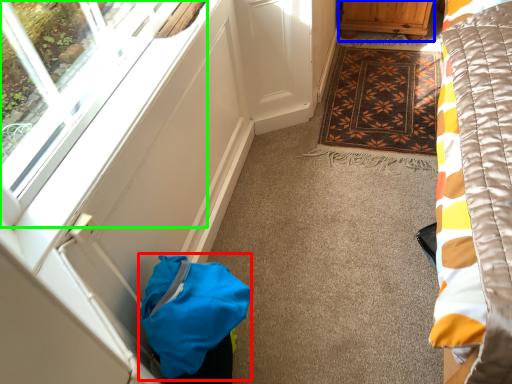
Question: Which is farther away from bag (highlighted by a red box)? furniture (highlighted by a blue box) or window (highlighted by a green box)?

Choices:
 (A) furniture
 (B) window

Answer: (A)